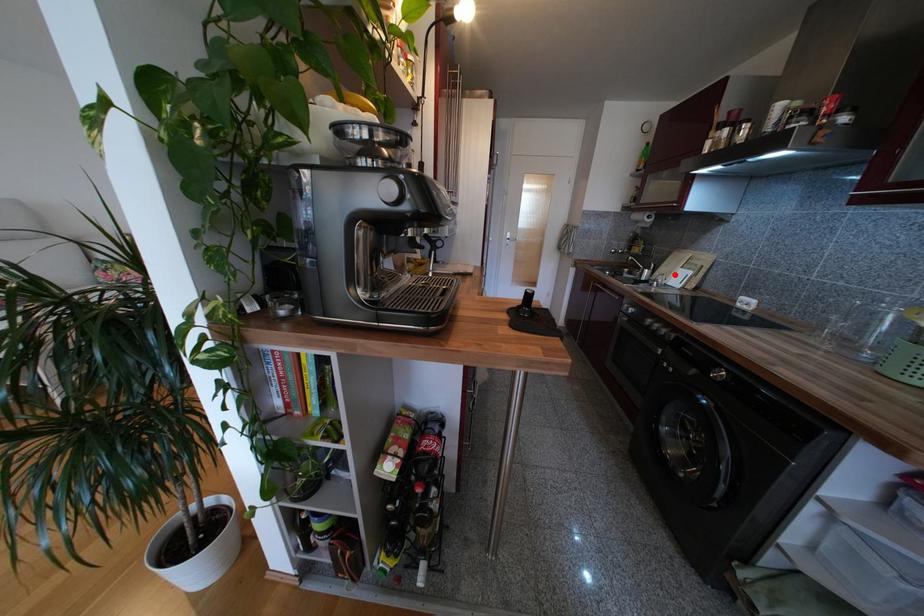
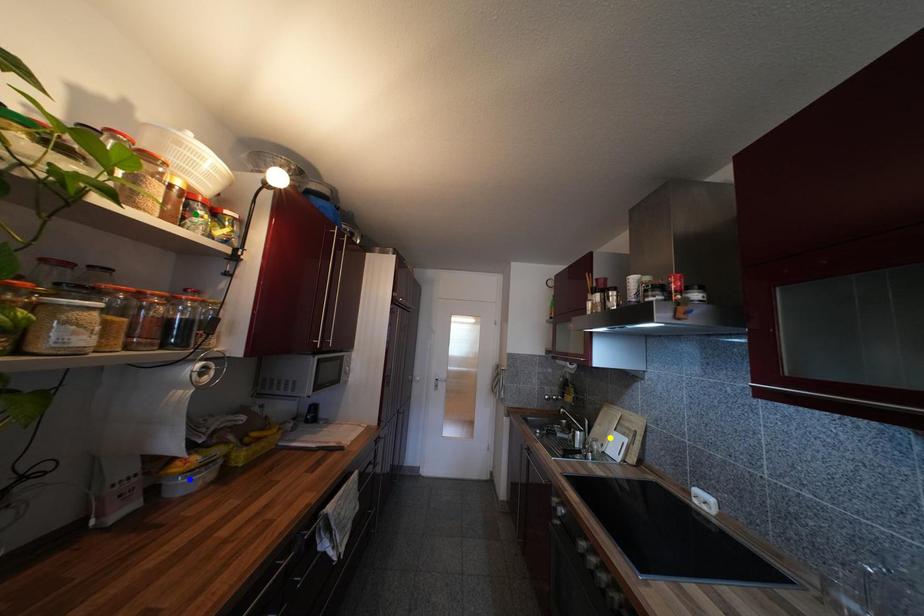
Question: I am providing you with two images of the same scene from different viewpoints. A red point is marked on the first image. You are given multiple points on the second image. Which point in image 2 represents the same 3d spot as the red point in image 1?

Choices:
 (A) blue point
 (B) yellow point
 (C) green point

Answer: (B)